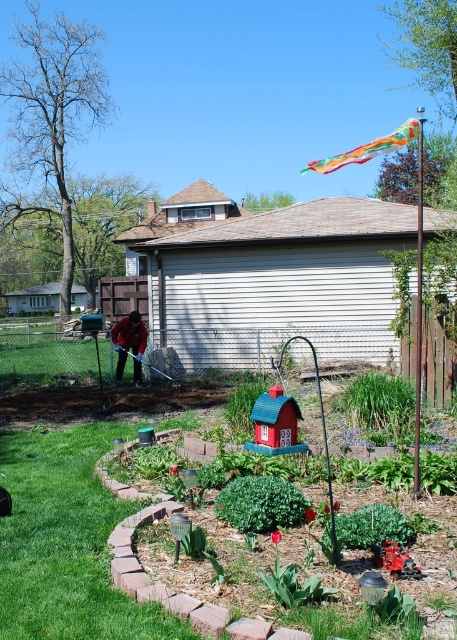
Question: Is rainbow fabric kite at upper right positioned before dark red sweater at center?

Choices:
 (A) no
 (B) yes

Answer: (B)

Question: Which of the following is the closest to the observer?

Choices:
 (A) rainbow fabric kite at upper right
 (B) dark red sweater at center

Answer: (A)

Question: Which object appears farthest from the camera in this image?

Choices:
 (A) dark red sweater at center
 (B) rainbow fabric kite at upper right

Answer: (A)

Question: Is rainbow fabric kite at upper right below dark red sweater at center?

Choices:
 (A) yes
 (B) no

Answer: (B)

Question: Is rainbow fabric kite at upper right positioned at the back of dark red sweater at center?

Choices:
 (A) yes
 (B) no

Answer: (B)